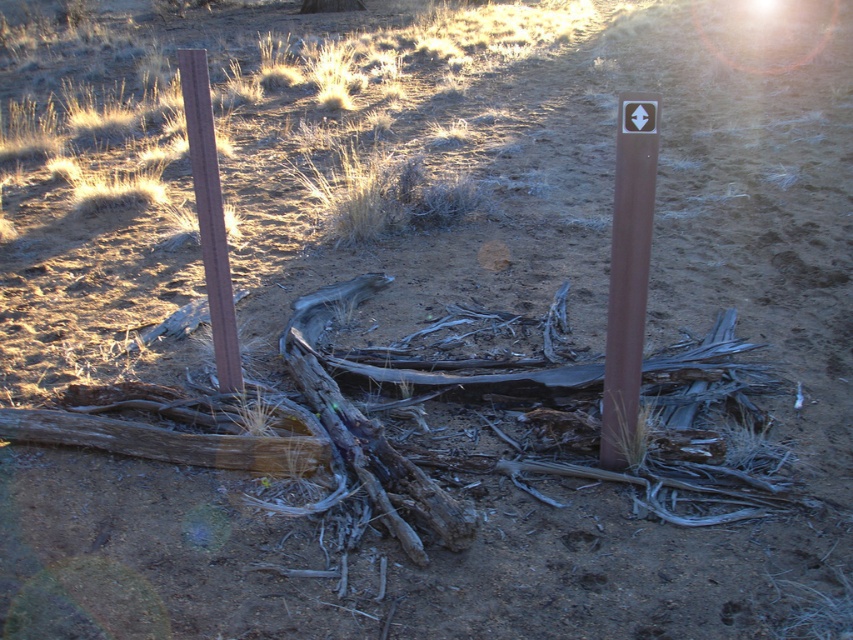
You are standing in the desert scene and want to touch both the brown matte post at center and the brown wood post at left. Which post should you approach first to reach the one closer to you?

You should approach the brown matte post at center first since it is closer to the viewer than the brown wood post at left.

You are a hiker who wants to set up a tent in the shade. You see the brown matte post at center and the brown wood post at left. Which post would provide more shade for your tent?

The brown wood post at left would provide more shade for your tent because the brown matte post at center is positioned under it, meaning the taller post casts a larger shadow.

You are a hiker trying to set up a tent between the brown matte post at center and the brown wood post at left. Which post should you place the tent closer to if you want it to be sheltered from the wind coming from the left side?

The brown wood post at left is taller than the brown matte post at center, so placing the tent closer to the brown wood post at left would provide better shelter from the wind coming from the left side.